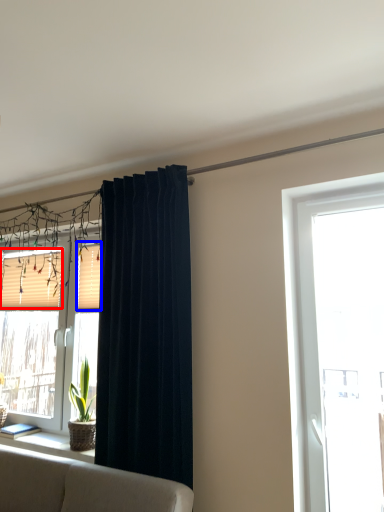
Question: Which object is closer to the camera taking this photo, shutter (highlighted by a red box) or shutter (highlighted by a blue box)?

Choices:
 (A) shutter
 (B) shutter

Answer: (B)